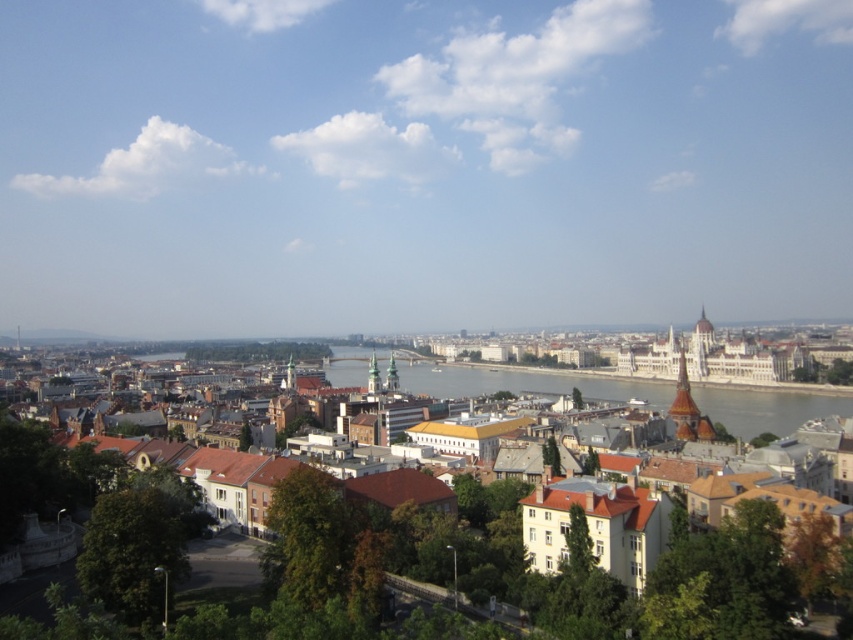
Question: Which of the following is the farthest from the observer?

Choices:
 (A) (453, 372)
 (B) (543, 376)

Answer: (A)

Question: Which point appears farthest from the camera in this image?

Choices:
 (A) (830, 406)
 (B) (735, 413)

Answer: (A)

Question: Is brown textured buildings at center wider than greenish water at center?

Choices:
 (A) yes
 (B) no

Answer: (A)

Question: Is brown textured buildings at center to the right of greenish water at center from the viewer's perspective?

Choices:
 (A) yes
 (B) no

Answer: (B)

Question: Which of the following is the farthest from the observer?

Choices:
 (A) greenish water at center
 (B) brown textured buildings at center

Answer: (A)

Question: In this image, where is brown textured buildings at center located relative to greenish water at center?

Choices:
 (A) left
 (B) right

Answer: (A)